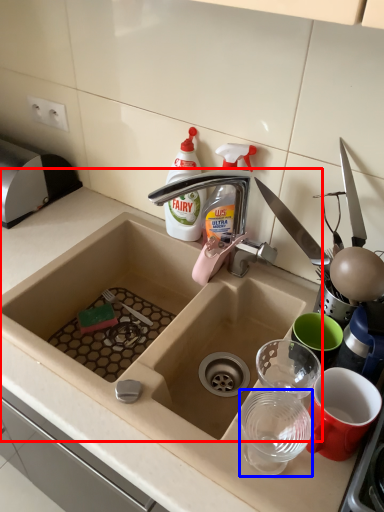
Question: Which object appears farthest to the camera in this image, sink (highlighted by a red box) or tableware (highlighted by a blue box)?

Choices:
 (A) sink
 (B) tableware

Answer: (B)